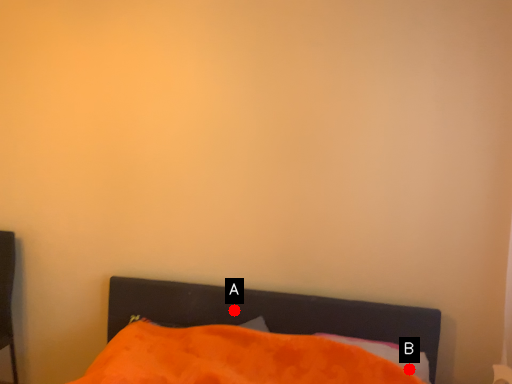
Question: Two points are circled on the image, labeled by A and B beside each circle. Which point is farther from the camera taking this photo?

Choices:
 (A) A is further
 (B) B is further

Answer: (A)